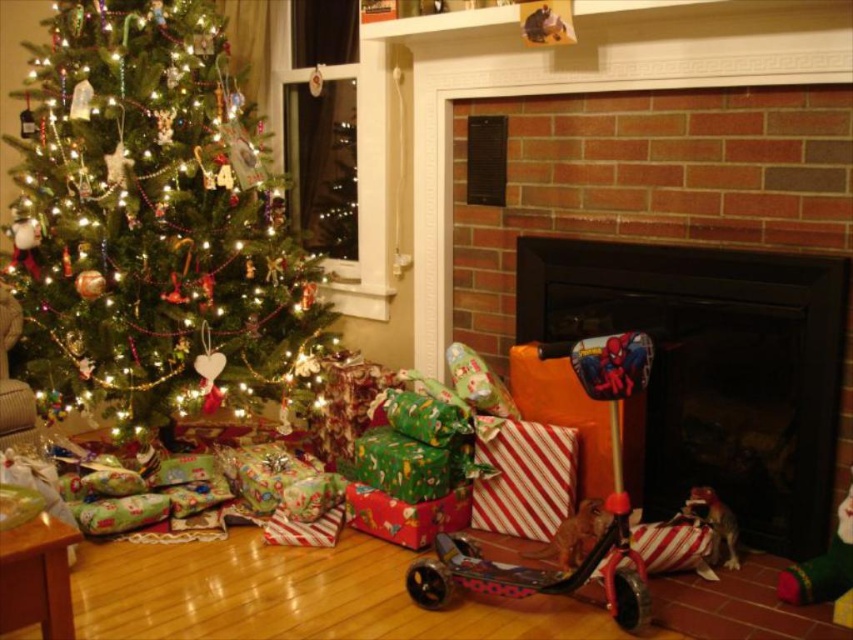
You are standing in the living room and want to place a new ornament on the mantel of the black matte fireplace at center. Based on its coordinates, where exactly should you look to place the ornament?

The black matte fireplace at center is located at coordinates point (712,368), so you should aim for that specific point to place the ornament on its mantel.

You are a delivery person who needs to place a metallic pink scooter at lower center in the hallway. The hallway is narrow, and you must ensure that the black matte fireplace at center won

The black matte fireplace at center is 21.21 inches away from the metallic pink scooter at lower center. Since the distance between them is 21.21 inches, the scooter can be placed in the hallway without obstructing the fireplace as long as there is enough space in the hallway to accommodate the scooter

You are planning to place a large Christmas decoration between the shiny green tree at left and the black matte fireplace at center. Considering their sizes, which object should you place the decoration closer to to ensure it doesn

The shiny green tree at left is wider than the black matte fireplace at center, so placing the decoration closer to the tree would account for its larger size.